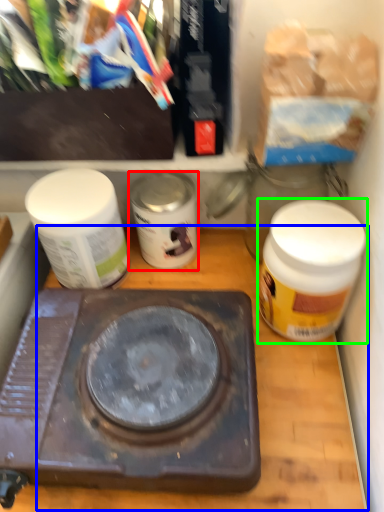
Question: Estimate the real-world distances between objects in this image. Which object is closer to bottle (highlighted by a red box), counter top (highlighted by a blue box) or bottle (highlighted by a green box)?

Choices:
 (A) counter top
 (B) bottle

Answer: (A)